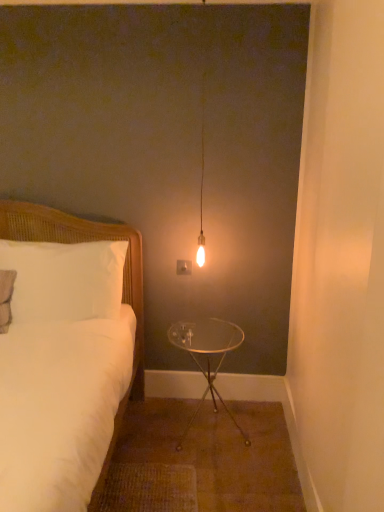
Question: Does white woven bed at left turn towards white wicker pillow at left?

Choices:
 (A) yes
 (B) no

Answer: (B)

Question: Does white woven bed at left contain white wicker pillow at left?

Choices:
 (A) no
 (B) yes

Answer: (B)

Question: From a real-world perspective, is white woven bed at left beneath white wicker pillow at left?

Choices:
 (A) no
 (B) yes

Answer: (B)

Question: Is white woven bed at left positioned behind white wicker pillow at left?

Choices:
 (A) no
 (B) yes

Answer: (A)

Question: Considering the relative sizes of white woven bed at left and white wicker pillow at left in the image provided, is white woven bed at left wider than white wicker pillow at left?

Choices:
 (A) yes
 (B) no

Answer: (A)

Question: In terms of height, does white woven bed at left look taller or shorter compared to clear glass table at center?

Choices:
 (A) short
 (B) tall

Answer: (B)

Question: Is white woven bed at left in front of or behind clear glass table at center in the image?

Choices:
 (A) front
 (B) behind

Answer: (A)

Question: Is point (31, 220) closer or farther from the camera than point (211, 351)?

Choices:
 (A) farther
 (B) closer

Answer: (A)

Question: Visually, is white woven bed at left positioned to the left or to the right of clear glass table at center?

Choices:
 (A) left
 (B) right

Answer: (A)

Question: In terms of width, does white woven bed at left look wider or thinner when compared to matte glass bulb at center?

Choices:
 (A) thin
 (B) wide

Answer: (B)

Question: Do you think white woven bed at left is within matte glass bulb at center, or outside of it?

Choices:
 (A) outside
 (B) inside

Answer: (A)

Question: Does point (82, 217) appear closer or farther from the camera than point (203, 10)?

Choices:
 (A) farther
 (B) closer

Answer: (A)

Question: In the image, is white woven bed at left on the left side or the right side of matte glass bulb at center?

Choices:
 (A) left
 (B) right

Answer: (A)

Question: Would you say white wicker pillow at left is inside or outside matte glass bulb at center?

Choices:
 (A) inside
 (B) outside

Answer: (B)

Question: Relative to matte glass bulb at center, is white wicker pillow at left in front or behind?

Choices:
 (A) front
 (B) behind

Answer: (B)